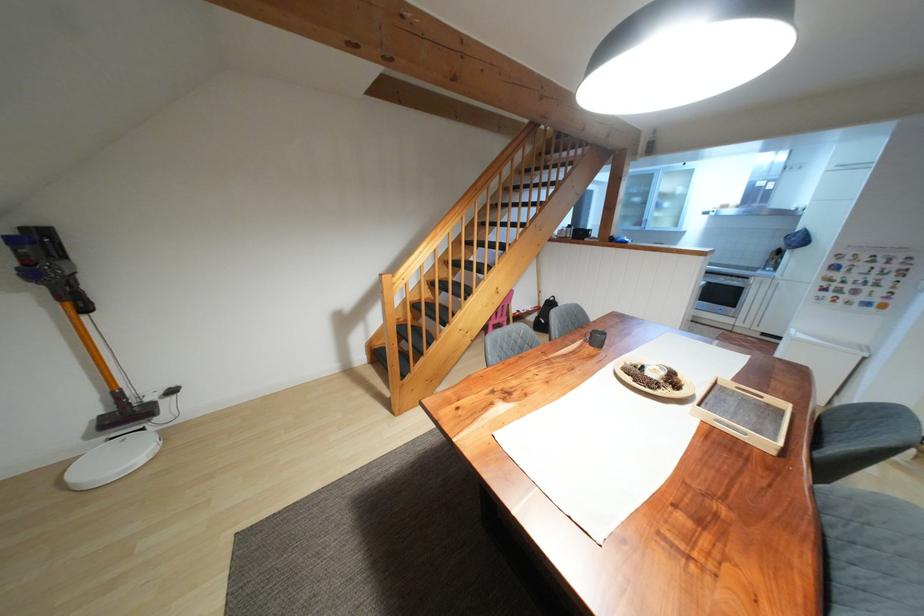
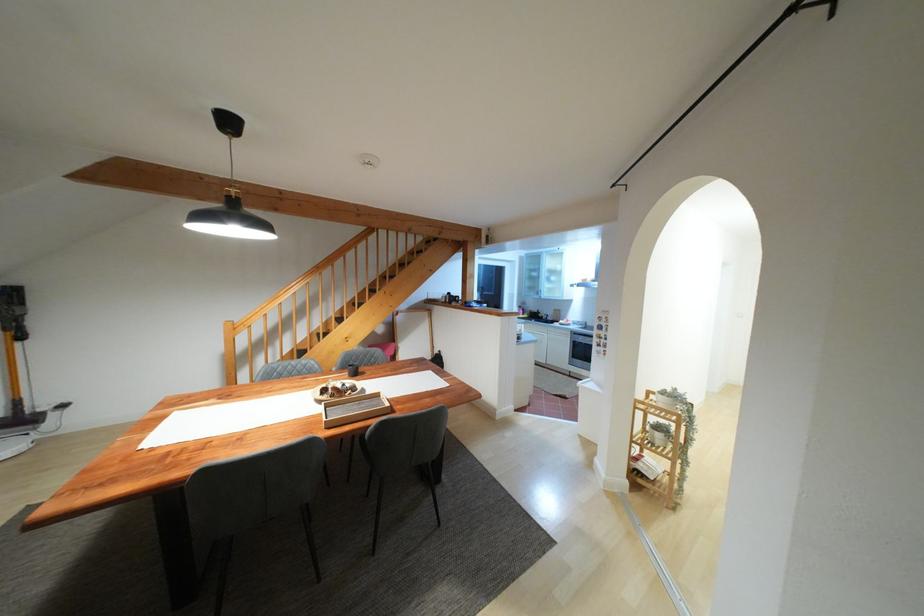
Question: In a continuous first-person perspective shot, in which direction is the camera moving?

Choices:
 (A) Left
 (B) Right
 (C) Forward
 (D) Backward

Answer: (B)